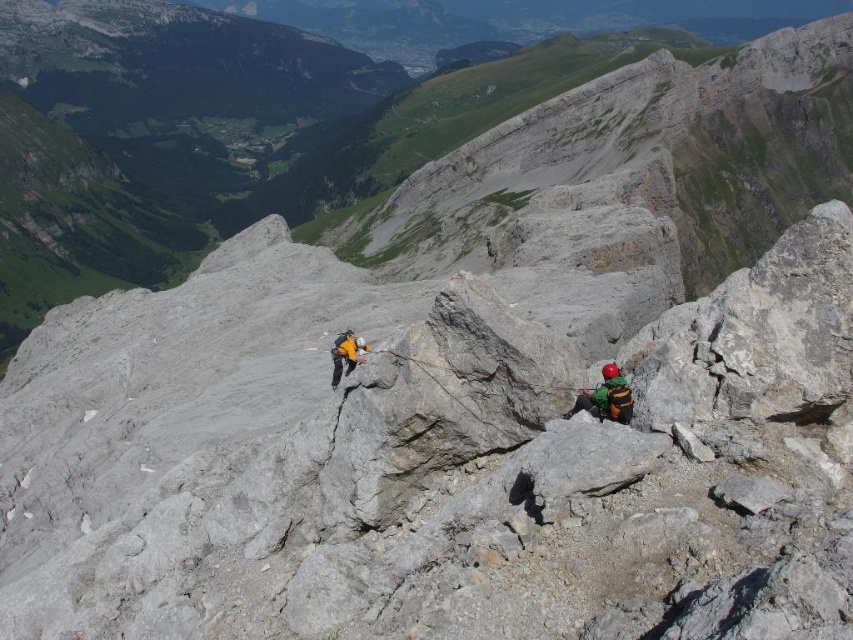
Describe the element at coordinates (476, 372) in the screenshot. The width and height of the screenshot is (853, 640). I see `ropetexturedrope at center` at that location.

Looking at this image, who is more forward, (497,369) or (628,404)?

Point (628,404) is more forward.

The image size is (853, 640). In order to click on ropetexturedrope at center in this screenshot , I will do `click(476, 372)`.

Which is below, green fabric harness at center or yellow fabric helmet at center?

green fabric harness at center is below.

Does green fabric harness at center have a smaller size compared to yellow fabric helmet at center?

Yes, green fabric harness at center is smaller than yellow fabric helmet at center.

I want to click on green fabric harness at center, so click(x=606, y=397).

Identify the location of green fabric harness at center. This screenshot has width=853, height=640. (606, 397).

Does ropetexturedrope at center appear on the left side of yellow fabric helmet at center?

In fact, ropetexturedrope at center is to the right of yellow fabric helmet at center.

Does point (546, 388) come in front of point (355, 339)?

Yes, point (546, 388) is closer to viewer.

Where is `ropetexturedrope at center`? This screenshot has width=853, height=640. ropetexturedrope at center is located at coordinates (476, 372).